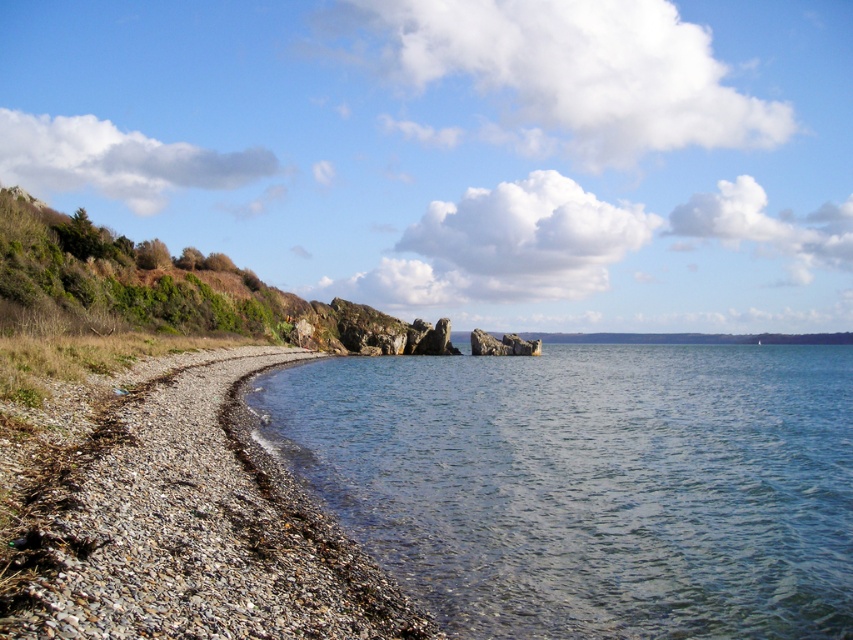
You are standing on the smooth pebbles at lower left and want to reach the clear water at lower left. Based on the scene description, which direction should you move to get to the water?

The clear water at lower left is shorter than the smooth pebbles at lower left, so you should move downward towards the lower part of the smooth pebbles at lower left to reach the clear water at lower left.

You are standing at the center of the shoreline and want to reach the clear water at lower left. According to the coordinates provided, in which direction should you move to get there?

The clear water at lower left is located at coordinates point (589,484). Since the coordinates are based on a standard grid where the origin is at the bottom left corner, the x and y values both being above 0.5 indicate that the clear water at lower left is actually positioned towards the upper right of the image. Therefore, you should move towards the upper right direction to reach it.

You are standing on the rocky outcrop and looking towards the shoreline. Which object, the smooth pebbles at lower left or the clear water at lower left, is closer to you?

The clear water at lower left is closer to you because the smooth pebbles at lower left is behind it.